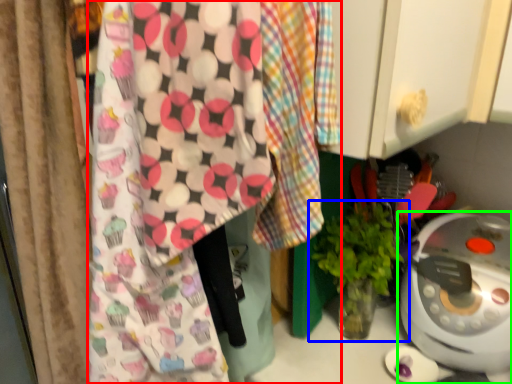
Question: Which is nearer to the wrapping paper (highlighted by a red box)? houseplant (highlighted by a blue box) or home appliance (highlighted by a green box).

Choices:
 (A) houseplant
 (B) home appliance

Answer: (A)